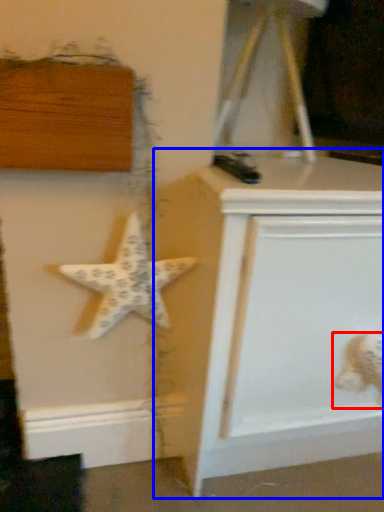
Question: Which object is further to the camera taking this photo, toy (highlighted by a red box) or vanity (highlighted by a blue box)?

Choices:
 (A) toy
 (B) vanity

Answer: (A)